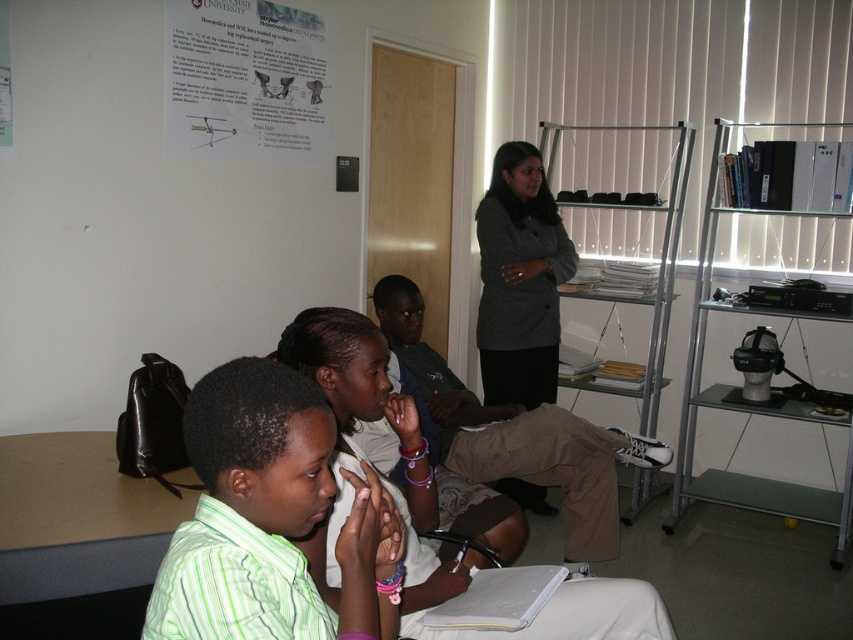
You are standing in the room and want to reach both the point at coordinates (280, 120) and the point at (573, 525). Which point will you reach first as you move forward?

You will reach the point at coordinates (280, 120) first because it is closer to you than the point at (573, 525).

Consider the image. You are a delivery robot with a package that measures 1.5 meters in length. You need to place it between the brown leather table at lower left and the dark gray blazer at center. Is there enough space for the package?

The distance between the brown leather table at lower left and the dark gray blazer at center is 1.85 meters. Since the package is 1.5 meters long, there is sufficient space to place it between them.